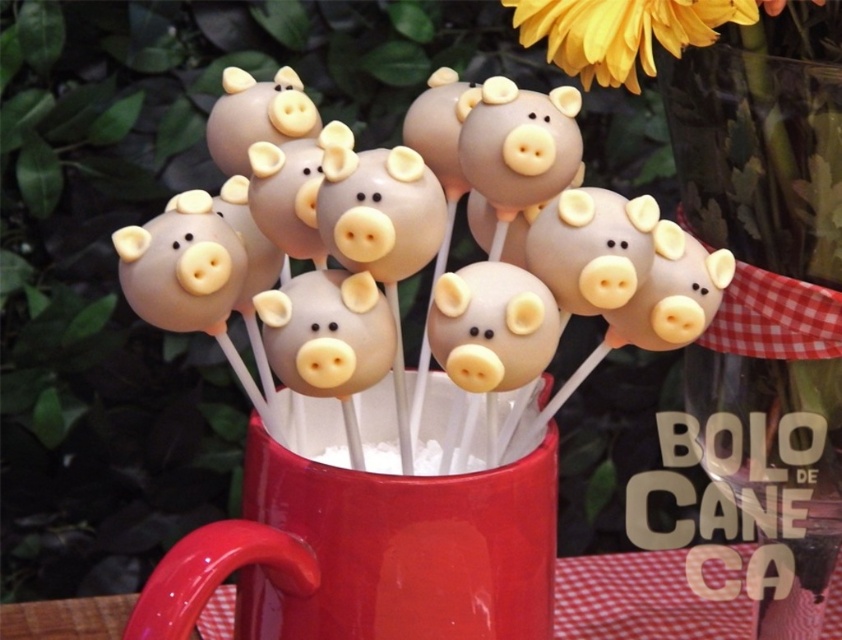
Question: Is matte ceramic mug at center below yellow matte flower at upper center?

Choices:
 (A) no
 (B) yes

Answer: (B)

Question: Which point is closer to the camera?

Choices:
 (A) yellow matte flower at upper center
 (B) matte ceramic mug at center

Answer: (B)

Question: Can you confirm if matte ceramic mug at center is positioned below yellow matte flower at upper center?

Choices:
 (A) yes
 (B) no

Answer: (A)

Question: Which point is farther to the camera?

Choices:
 (A) yellow matte flower at upper center
 (B) matte ceramic mug at center

Answer: (A)

Question: In this image, where is matte ceramic mug at center located relative to yellow matte flower at upper center?

Choices:
 (A) right
 (B) left

Answer: (B)